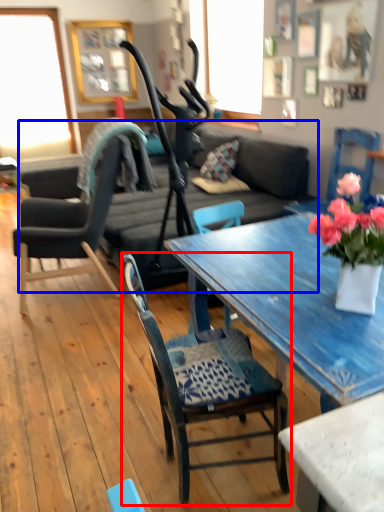
Question: Which object is closer to the camera taking this photo, chair (highlighted by a red box) or studio couch (highlighted by a blue box)?

Choices:
 (A) chair
 (B) studio couch

Answer: (A)